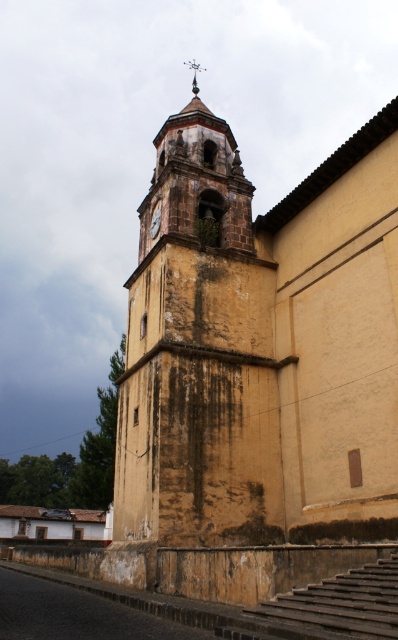
Based on the photo, you are an architect assessing the historic church tower. You notice the yellowish stucco tower at center and the brown wooden clock at center. Which object is taller?

The yellowish stucco tower at center is taller than the brown wooden clock at center.

You are standing at the bottom of the brown stone stairs at lower right and want to reach the yellowish stucco tower at center. Which direction should you move to get closer to the tower?

You should move upward because the yellowish stucco tower at center is above the brown stone stairs at lower right, so moving upward will bring you closer to the tower.